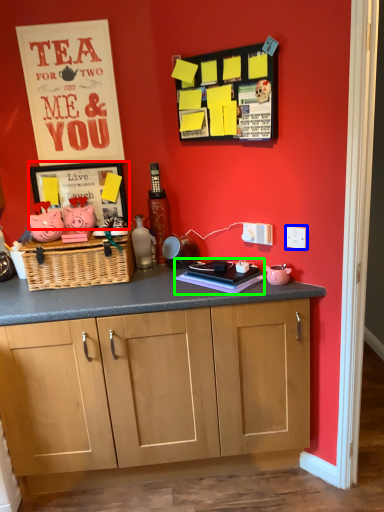
Question: Estimate the real-world distances between objects in this image. Which object is closer to picture frame (highlighted by a red box), electric outlet (highlighted by a blue box) or book (highlighted by a green box)?

Choices:
 (A) electric outlet
 (B) book

Answer: (B)